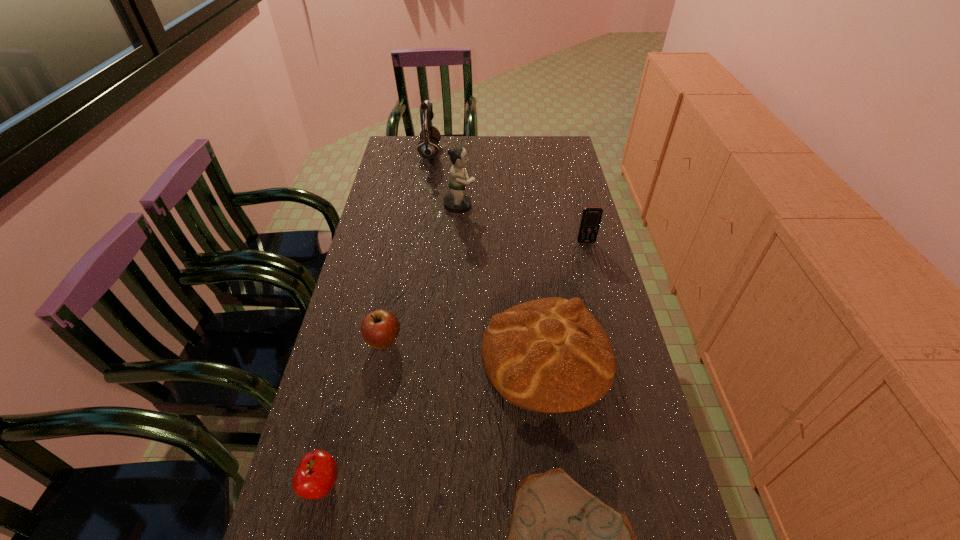
At what (x,y) coordinates should I click in order to perform the action: click on vacant space located 0.110m on the back of the bread. Please return your answer as a coordinate pair (x, y). Looking at the image, I should click on (537, 277).

Find the location of a particular element. The height and width of the screenshot is (540, 960). free region located on the right of the farther apple is located at coordinates (442, 342).

The width and height of the screenshot is (960, 540). What are the coordinates of `vacant space situated on the right of the nearer apple` in the screenshot? It's located at 396,484.

Locate an element on the screen. object at the far edge is located at coordinates (428, 148).

This screenshot has width=960, height=540. I want to click on earphone that is at the left edge, so click(x=428, y=148).

Where is `cellular telephone that is at the right edge`? The width and height of the screenshot is (960, 540). cellular telephone that is at the right edge is located at coordinates (591, 217).

Where is `bread positioned at the right edge`? bread positioned at the right edge is located at coordinates (551, 355).

Find the location of a particular element. The width and height of the screenshot is (960, 540). object present at the far left corner is located at coordinates (428, 148).

This screenshot has height=540, width=960. In the image, there is a desktop. Identify the location of blank space at the far edge. tap(519, 162).

In the image, there is a desktop. Identify the location of vacant space at the left edge. This screenshot has height=540, width=960. (396, 181).